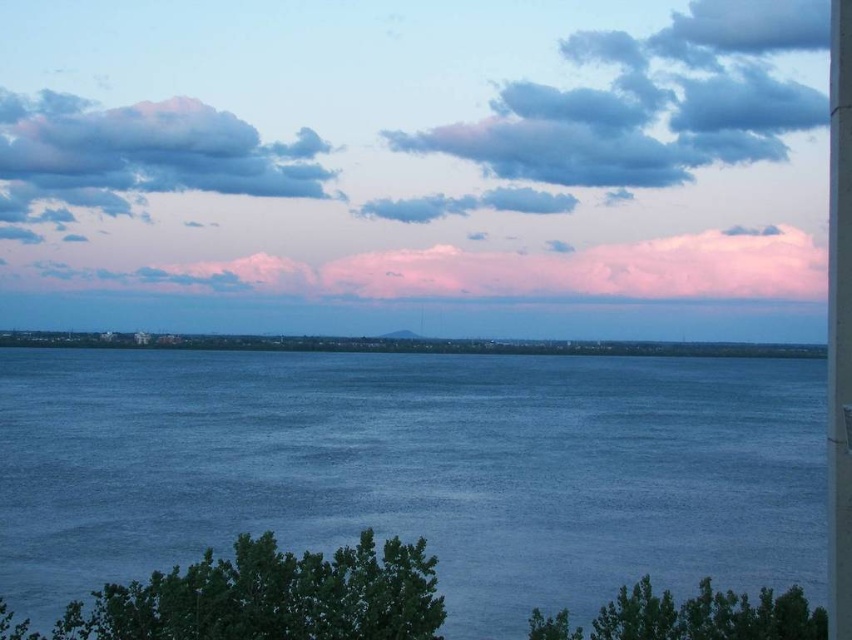
Question: Does blue water at center appear over smooth concrete pillar at right?

Choices:
 (A) yes
 (B) no

Answer: (B)

Question: Does blue water at center have a lesser width compared to pink fluffy cloud at upper center?

Choices:
 (A) yes
 (B) no

Answer: (A)

Question: Observing the image, what is the correct spatial positioning of pink cotton clouds at upper center in reference to cloudy sky at upper left?

Choices:
 (A) right
 (B) left

Answer: (A)

Question: Which point is farther from the camera taking this photo?

Choices:
 (A) (373, 147)
 (B) (697, 564)

Answer: (A)

Question: Which is nearer to the pink fluffy cloud at upper center?

Choices:
 (A) blue water at center
 (B) cloudy sky at upper left
 (C) smooth concrete pillar at right
 (D) pink cotton clouds at upper center

Answer: (D)

Question: Which point is farther to the camera?

Choices:
 (A) cloudy sky at upper left
 (B) blue water at center
 (C) pink fluffy cloud at upper center
 (D) pink cotton clouds at upper center

Answer: (A)